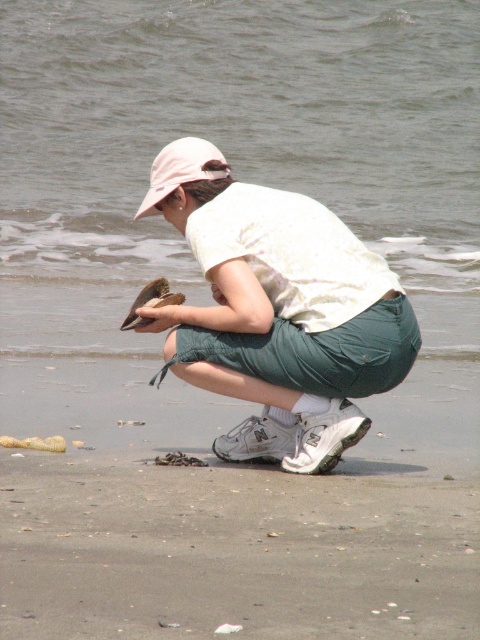
You are a photographer trying to capture a clear photo of the brown feathered bird at center. However, the white cotton shirt at center is blocking your view. Can you tell me which object is closer to you based on the scene?

The white cotton shirt at center is closer to you since it is in front of the brown feathered bird at center, blocking the view.

You are a photographer trying to capture both the white cotton shirt at center and the brown feathered bird at center in a single frame. Based on their sizes, which object should you focus on first to ensure both are in the frame?

The white cotton shirt at center is taller than the brown feathered bird at center, so you should focus on the white cotton shirt at center first to ensure both are in the frame.